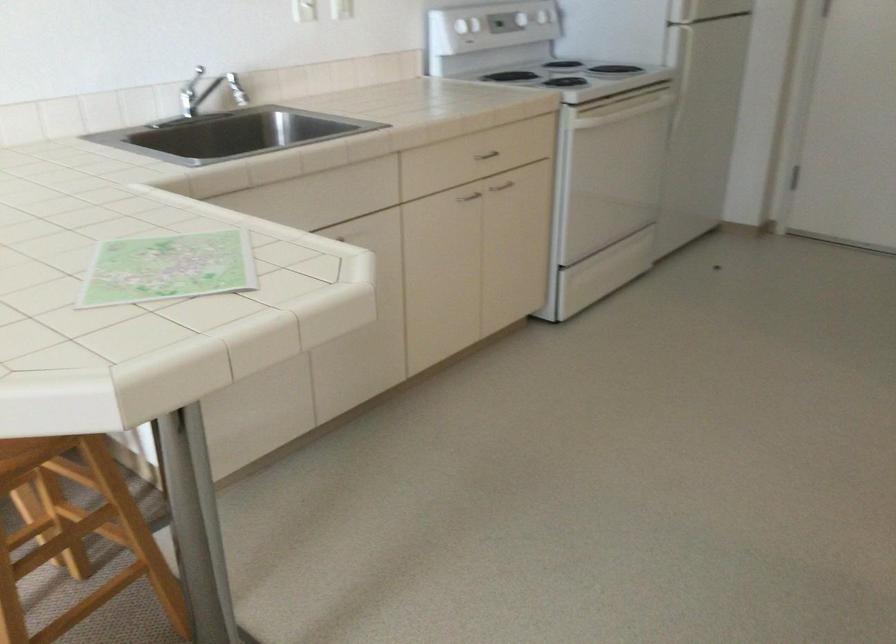
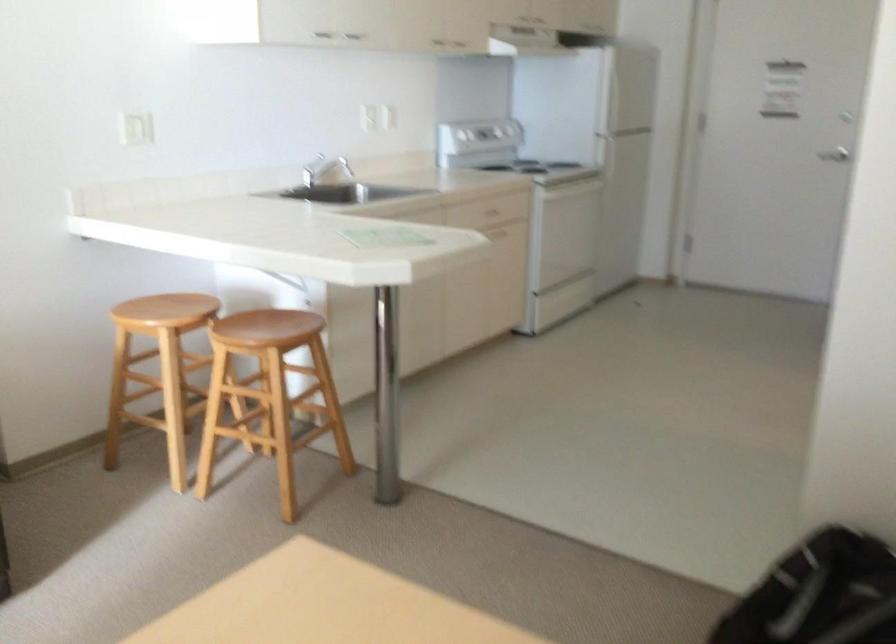
The point at (214, 104) is marked in the first image. Where is the corresponding point in the second image?

(317, 171)